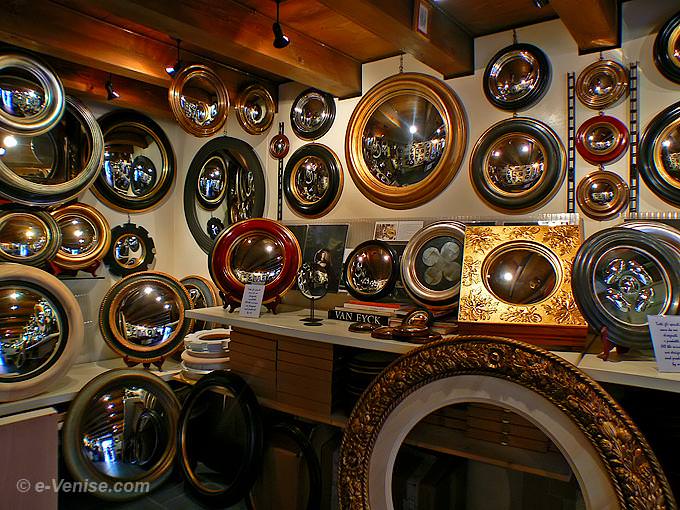
Find the location of a particular element. Image resolution: width=680 pixels, height=510 pixels. wall mounts is located at coordinates (277, 190), (573, 166), (630, 165).